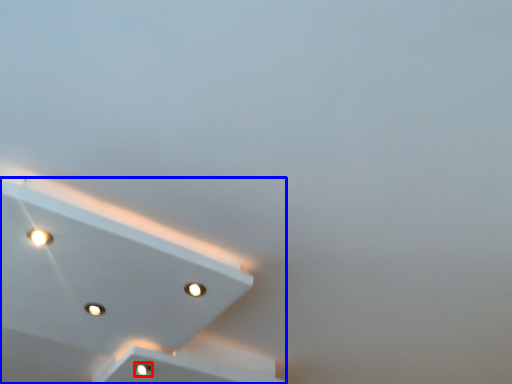
Question: Among these objects, which one is nearest to the camera, dot (highlighted by a red box) or lamp (highlighted by a blue box)?

Choices:
 (A) dot
 (B) lamp

Answer: (B)